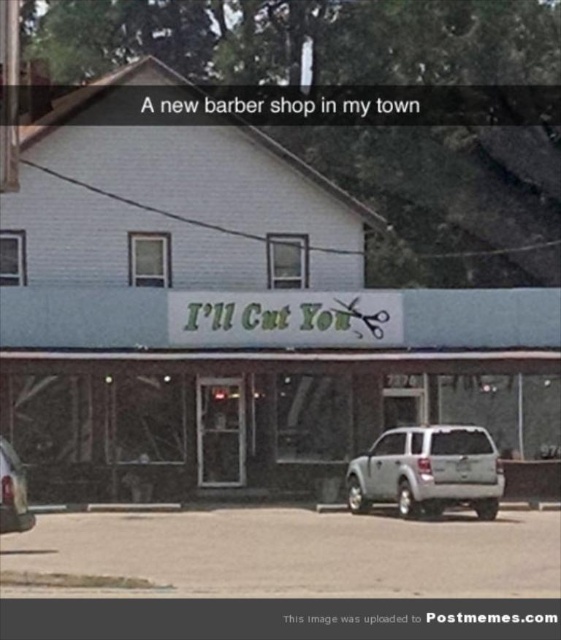
Question: Among these points, which one is farthest from the camera?

Choices:
 (A) (1, 509)
 (B) (383, 316)
 (C) (495, 502)

Answer: (B)

Question: Where is white matte building at center located in relation to silver metallic suv at center in the image?

Choices:
 (A) right
 (B) left

Answer: (A)

Question: Does satin silver suv at center appear on the left side of silver metallic suv at center?

Choices:
 (A) no
 (B) yes

Answer: (A)

Question: Which point appears farthest from the camera in this image?

Choices:
 (A) (404, 484)
 (B) (555, 380)
 (C) (6, 467)

Answer: (B)

Question: Can you confirm if white matte building at center is positioned below satin silver suv at center?

Choices:
 (A) yes
 (B) no

Answer: (B)

Question: Among these objects, which one is nearest to the camera?

Choices:
 (A) white matte building at center
 (B) silver metallic suv at center
 (C) satin silver suv at center

Answer: (B)